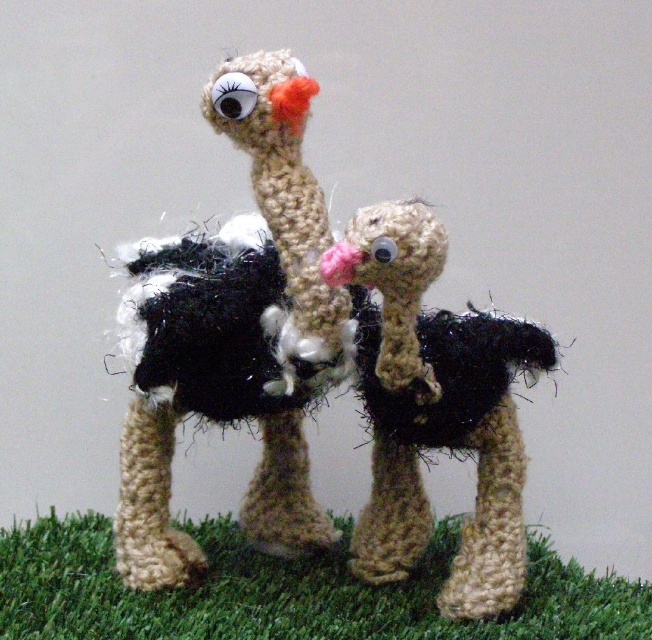
Is fuzzy black and white ostrich at center taller than fuzzy black ostrich at center?

Yes, fuzzy black and white ostrich at center is taller than fuzzy black ostrich at center.

Does point (261, 163) lie in front of point (537, 333)?

Yes, point (261, 163) is in front of point (537, 333).

This screenshot has width=652, height=640. Describe the element at coordinates (235, 336) in the screenshot. I see `fuzzy black and white ostrich at center` at that location.

The image size is (652, 640). In order to click on fuzzy black and white ostrich at center in this screenshot , I will do `click(235, 336)`.

Is point (140, 413) farther from camera compared to point (432, 636)?

Yes, point (140, 413) is farther from viewer.

Does fuzzy black and white ostrich at center have a lesser width compared to green artificial turf at lower center?

Yes.

Between point (304, 467) and point (527, 540), which one is positioned in front?

Positioned in front is point (304, 467).

The height and width of the screenshot is (640, 652). Find the location of `fuzzy black and white ostrich at center`. fuzzy black and white ostrich at center is located at coordinates (235, 336).

Can you confirm if green artificial turf at lower center is positioned to the left of fuzzy black ostrich at center?

Correct, you'll find green artificial turf at lower center to the left of fuzzy black ostrich at center.

Does point (546, 557) come behind point (481, 554)?

Yes, it is.

Locate an element on the screen. The image size is (652, 640). green artificial turf at lower center is located at coordinates (286, 592).